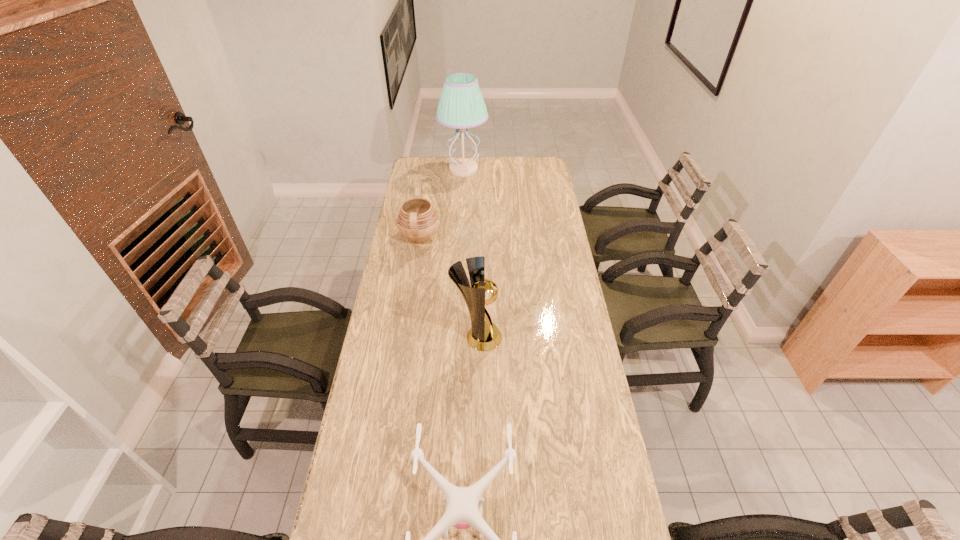
Locate an element on the screen. This screenshot has width=960, height=540. the farthest object is located at coordinates (461, 105).

In order to click on lamp in this screenshot , I will do `click(461, 105)`.

I want to click on award, so click(x=484, y=335).

Identify the location of the second tallest object. (484, 335).

The width and height of the screenshot is (960, 540). What are the coordinates of `the third nearest object` in the screenshot? It's located at (418, 221).

Identify the location of urn. The height and width of the screenshot is (540, 960). (418, 221).

The image size is (960, 540). Find the location of `blank space located 0.340m on the right of the lamp`. blank space located 0.340m on the right of the lamp is located at coordinates (550, 170).

Where is `free space located at the front of the third farthest object, where the globe is visible`? This screenshot has width=960, height=540. free space located at the front of the third farthest object, where the globe is visible is located at coordinates (558, 338).

Where is `vacant point located 0.340m on the front-facing side of the urn`? vacant point located 0.340m on the front-facing side of the urn is located at coordinates (516, 238).

This screenshot has height=540, width=960. I want to click on object situated at the far edge, so click(461, 105).